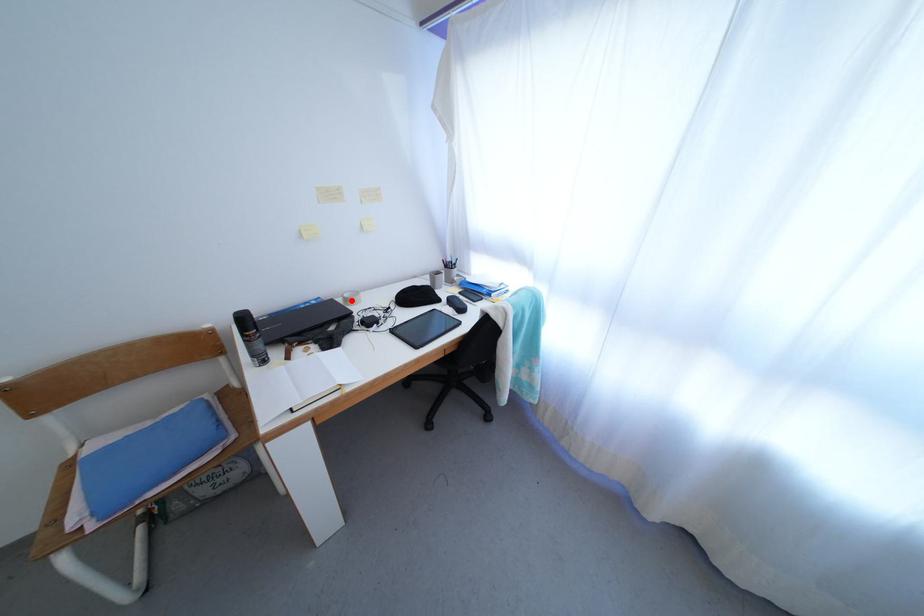
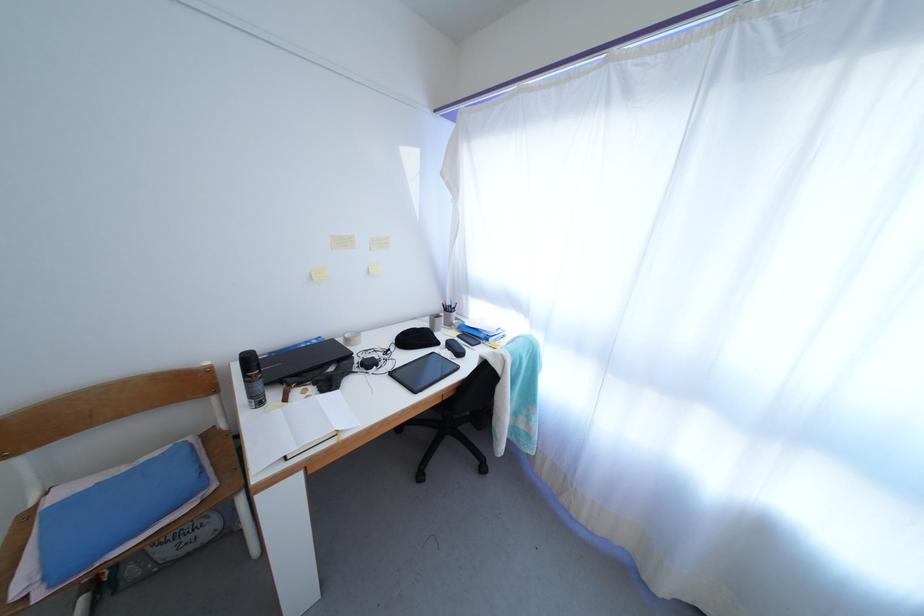
Question: A red point is marked in image1. In image2, is the corresponding 3D point closer to the camera or farther? Reply with the corresponding letter.

Choices:
 (A) The corresponding 3D point is closer.
 (B) The corresponding 3D point is farther.

Answer: (A)